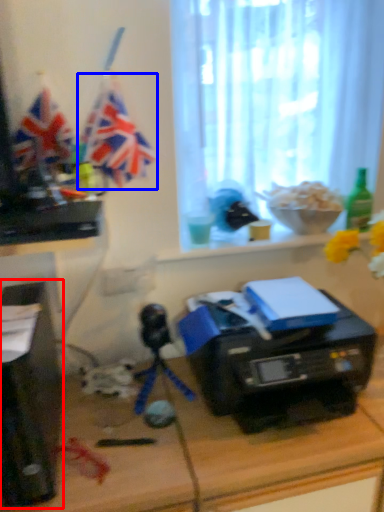
Question: Among these objects, which one is nearest to the camera, desktop computer (highlighted by a red box) or flag (highlighted by a blue box)?

Choices:
 (A) desktop computer
 (B) flag

Answer: (A)